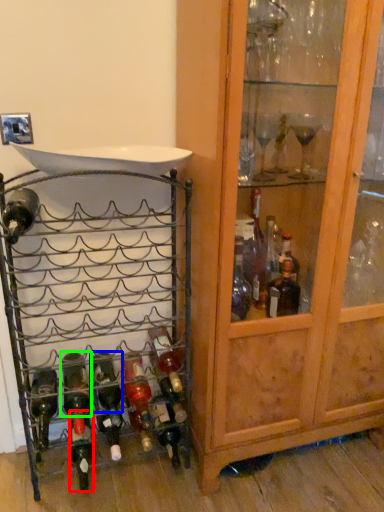
Question: Considering the real-world distances, which object is closest to bottle (highlighted by a red box)? bottle (highlighted by a blue box) or bottle (highlighted by a green box).

Choices:
 (A) bottle
 (B) bottle

Answer: (B)